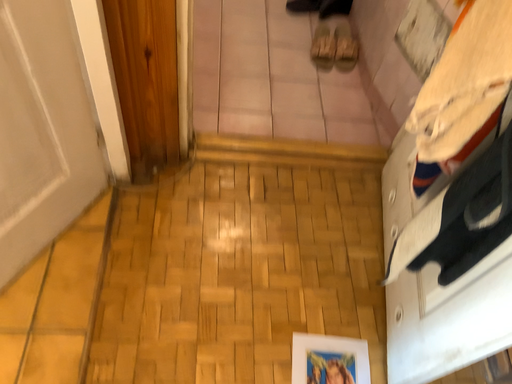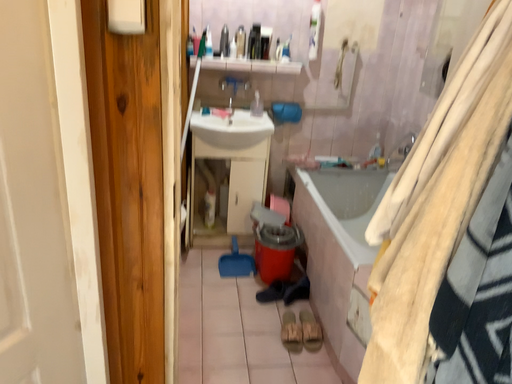
Question: How did the camera likely rotate when shooting the video?

Choices:
 (A) rotated downward
 (B) rotated upward

Answer: (B)